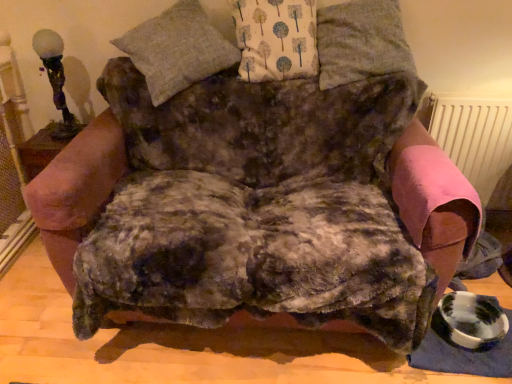
Question: Is matte glass table lamp at upper left at the left side of pink fabric radiator at right?

Choices:
 (A) yes
 (B) no

Answer: (A)

Question: Is matte glass table lamp at upper left behind pink fabric radiator at right?

Choices:
 (A) no
 (B) yes

Answer: (A)

Question: Is matte glass table lamp at upper left thinner than pink fabric radiator at right?

Choices:
 (A) yes
 (B) no

Answer: (B)

Question: Are matte glass table lamp at upper left and pink fabric radiator at right located far from each other?

Choices:
 (A) yes
 (B) no

Answer: (A)

Question: Is matte glass table lamp at upper left beside pink fabric radiator at right?

Choices:
 (A) no
 (B) yes

Answer: (A)

Question: Considering the relative sizes of matte glass table lamp at upper left and pink fabric radiator at right in the image provided, is matte glass table lamp at upper left bigger than pink fabric radiator at right?

Choices:
 (A) yes
 (B) no

Answer: (B)

Question: Does white fabric with tree pattern at upper center, the 2th pillow viewed from the left, have a smaller size compared to gray woolen pillow at upper center, which appears as the first pillow when viewed from the left?

Choices:
 (A) no
 (B) yes

Answer: (B)

Question: Is white fabric with tree pattern at upper center, the 2th pillow viewed from the left, bigger than gray woolen pillow at upper center, which is the 3th pillow in right-to-left order?

Choices:
 (A) no
 (B) yes

Answer: (A)

Question: Does white fabric with tree pattern at upper center, the 2th pillow viewed from the left, have a lesser height compared to gray woolen pillow at upper center, which is the 3th pillow in right-to-left order?

Choices:
 (A) no
 (B) yes

Answer: (B)

Question: From the image's perspective, does white fabric with tree pattern at upper center, which is the 2th pillow in right-to-left order, appear higher than gray woolen pillow at upper center, which is the 3th pillow in right-to-left order?

Choices:
 (A) yes
 (B) no

Answer: (A)

Question: Is white fabric with tree pattern at upper center, which is the 2th pillow in right-to-left order, positioned with its back to gray woolen pillow at upper center, which appears as the first pillow when viewed from the left?

Choices:
 (A) no
 (B) yes

Answer: (A)

Question: Considering the relative sizes of white fabric with tree pattern at upper center, which is the 2th pillow in right-to-left order, and gray woolen pillow at upper center, which is the 3th pillow in right-to-left order, in the image provided, is white fabric with tree pattern at upper center, which is the 2th pillow in right-to-left order, wider than gray woolen pillow at upper center, which is the 3th pillow in right-to-left order,?

Choices:
 (A) no
 (B) yes

Answer: (A)

Question: Does matte glass table lamp at upper left have a smaller size compared to gray woolen pillow at upper center, which appears as the first pillow when viewed from the left?

Choices:
 (A) no
 (B) yes

Answer: (B)